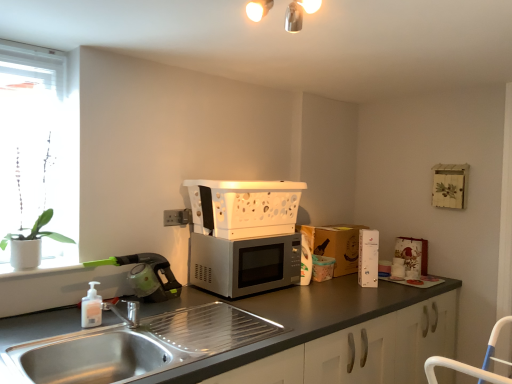
Question: Would you say white matte plant at left is inside or outside brown cardboard box at right?

Choices:
 (A) inside
 (B) outside

Answer: (B)

Question: Based on their positions, is white matte plant at left located to the left or right of brown cardboard box at right?

Choices:
 (A) left
 (B) right

Answer: (A)

Question: Estimate the real-world distances between objects in this image. Which object is farther from the white matte soap dispenser at sink left?

Choices:
 (A) white cardboard box at right, which ranks as the 3th appliance in left-to-right order
 (B) satin silver microwave at center
 (C) white plastic electric outlet at center
 (D) metallic at upper center
 (E) white glass window at left

Answer: (A)

Question: Based on their relative distances, which object is nearer to the green plastic vacuum cleaner at left, the first appliance positioned from the left?

Choices:
 (A) white plastic microwave at center, which is the 2th appliance from right to left
 (B) satin silver microwave at center
 (C) brown cardboard box at right
 (D) stainless steel sink at lower left
 (E) white plastic electric outlet at center

Answer: (E)